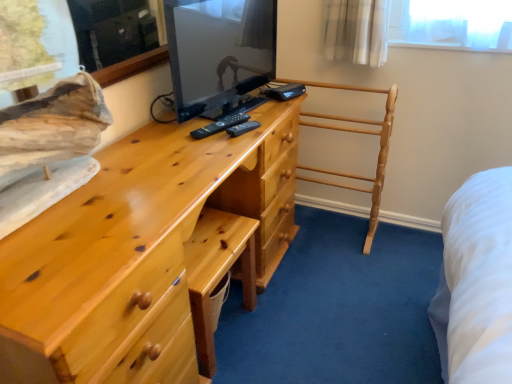
This screenshot has height=384, width=512. What are the coordinates of `vacant space in front of black plastic remote at center` in the screenshot? It's located at (207, 144).